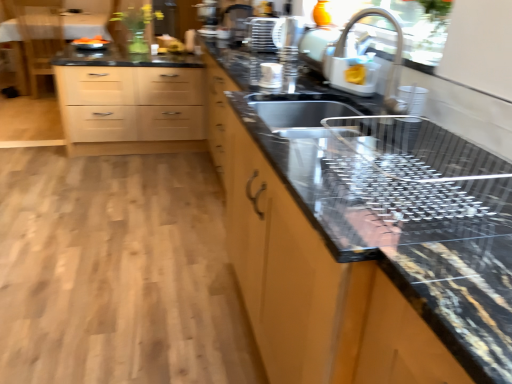
Question: Is wooden chair at upper left in front of metallic sink at center?

Choices:
 (A) yes
 (B) no

Answer: (B)

Question: Considering the relative sizes of wooden chair at upper left and metallic sink at center in the image provided, is wooden chair at upper left wider than metallic sink at center?

Choices:
 (A) yes
 (B) no

Answer: (A)

Question: Is the surface of wooden chair at upper left in direct contact with metallic sink at center?

Choices:
 (A) no
 (B) yes

Answer: (A)

Question: Could you tell me if wooden chair at upper left is turned towards metallic sink at center?

Choices:
 (A) no
 (B) yes

Answer: (A)

Question: From the image's perspective, does wooden chair at upper left appear lower than metallic sink at center?

Choices:
 (A) no
 (B) yes

Answer: (A)

Question: Is black granite table at upper left taller or shorter than black granite countertop at center?

Choices:
 (A) short
 (B) tall

Answer: (A)

Question: From a real-world perspective, is black granite table at upper left positioned above or below black granite countertop at center?

Choices:
 (A) above
 (B) below

Answer: (B)

Question: Is point (20, 74) positioned closer to the camera than point (323, 365)?

Choices:
 (A) farther
 (B) closer

Answer: (A)

Question: Looking at the image, does black granite table at upper left seem bigger or smaller compared to black granite countertop at center?

Choices:
 (A) small
 (B) big

Answer: (B)

Question: Looking at the image, does metallic grid at upper center, positioned as the 2th appliance in right-to-left order, seem bigger or smaller compared to light wood/finish chest of drawers at upper left?

Choices:
 (A) small
 (B) big

Answer: (A)

Question: Looking at their shapes, would you say metallic grid at upper center, positioned as the 1th appliance in top-to-bottom order, is wider or thinner than light wood/finish chest of drawers at upper left?

Choices:
 (A) wide
 (B) thin

Answer: (B)

Question: Is metallic grid at upper center, which appears as the second appliance when viewed from the front, inside the boundaries of light wood/finish chest of drawers at upper left, or outside?

Choices:
 (A) outside
 (B) inside

Answer: (A)

Question: From the image's perspective, is metallic grid at upper center, arranged as the first appliance when viewed from the left, positioned above or below light wood/finish chest of drawers at upper left?

Choices:
 (A) below
 (B) above

Answer: (B)

Question: Considering the positions of black granite table at upper left and metallic sink at center in the image, is black granite table at upper left taller or shorter than metallic sink at center?

Choices:
 (A) tall
 (B) short

Answer: (A)

Question: Considering the positions of black granite table at upper left and metallic sink at center in the image, is black granite table at upper left wider or thinner than metallic sink at center?

Choices:
 (A) thin
 (B) wide

Answer: (B)